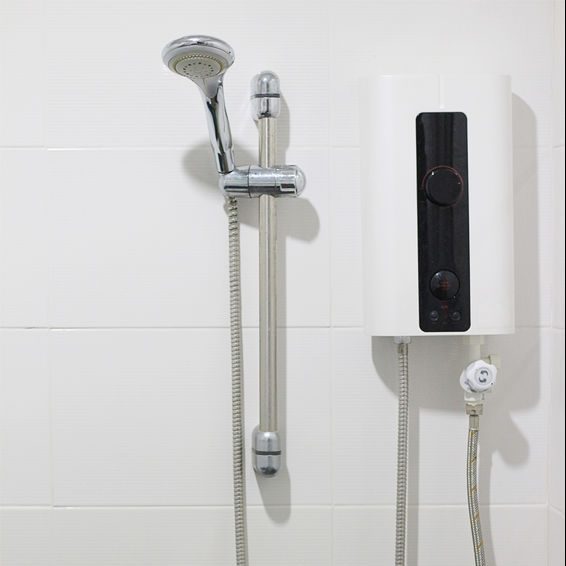
Locate an element on the screen. This screenshot has width=566, height=566. grout is located at coordinates (128, 509), (72, 325), (65, 150), (330, 528), (332, 421).